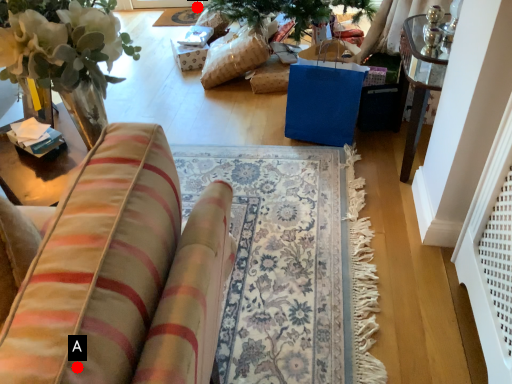
Question: Two points are circled on the image, labeled by A and B beside each circle. Which of the following is the closest to the observer?

Choices:
 (A) A is closer
 (B) B is closer

Answer: (A)